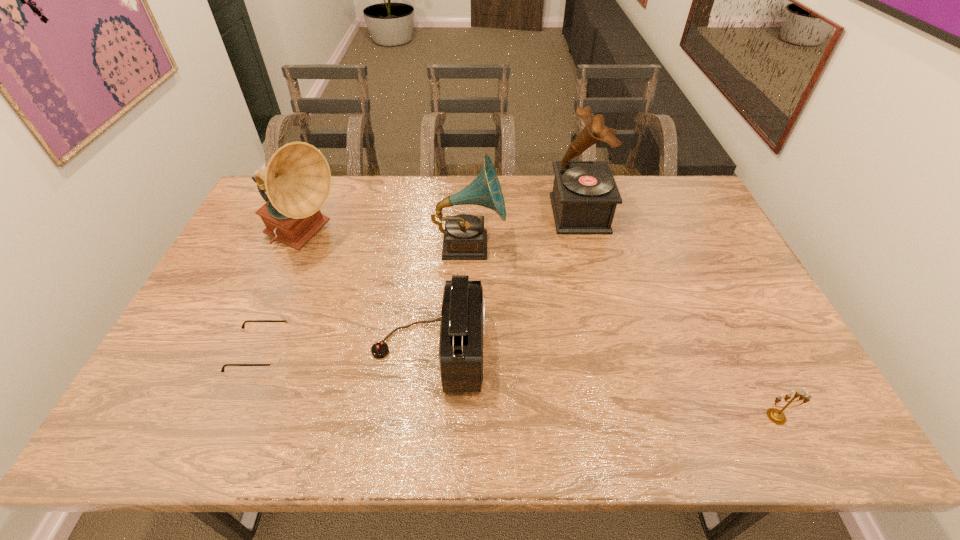
Where is `free space between the second shortest object and the rightmost phonograph_record`? free space between the second shortest object and the rightmost phonograph_record is located at coordinates (678, 315).

Find the location of a particular element. The width and height of the screenshot is (960, 540). free space between the rightmost object and the rightmost phonograph_record is located at coordinates pos(678,315).

Where is `free spot between the fourth tallest object and the leftmost phonograph_record`? free spot between the fourth tallest object and the leftmost phonograph_record is located at coordinates (367, 294).

Identify the location of free space that is in between the spectacles and the candelabrum. The width and height of the screenshot is (960, 540). (518, 384).

Image resolution: width=960 pixels, height=540 pixels. Identify the location of vacant area that lies between the nearest object and the rightmost phonograph_record. (678, 315).

The image size is (960, 540). Identify the location of free area in between the nearest object and the second phonograph_record from left to right. (623, 331).

Locate an element on the screen. This screenshot has height=540, width=960. object that is the second nearest to the second object from right to left is located at coordinates (462, 327).

Where is `object that is the third closest to the second shortest object`? Image resolution: width=960 pixels, height=540 pixels. object that is the third closest to the second shortest object is located at coordinates (464, 238).

You are a GUI agent. You are given a task and a screenshot of the screen. Output one action in this format:
    pyautogui.click(x=<x>, y=<y>)
    Task: Click on the third closest phonograph_record to the nearest object
    
    Given the screenshot: What is the action you would take?
    pyautogui.click(x=297, y=179)

Locate an element on the screen. This screenshot has height=540, width=960. phonograph_record that is the second closest to the shortest phonograph_record is located at coordinates (297, 179).